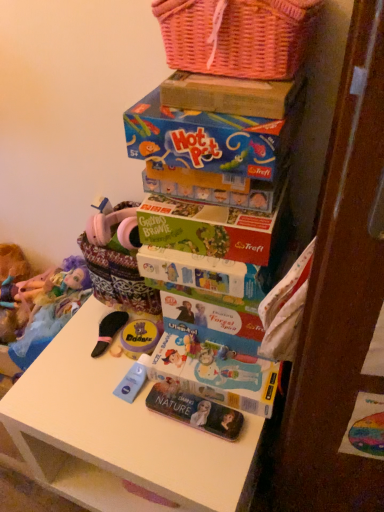
At what (x,y) coordinates should I click in order to perform the action: click on free spot in front of matte yellow container at center, marked as the 2th toy in a back-to-front arrangement. Please return your answer as a coordinate pair (x, y). The image size is (384, 512). Looking at the image, I should click on (124, 416).